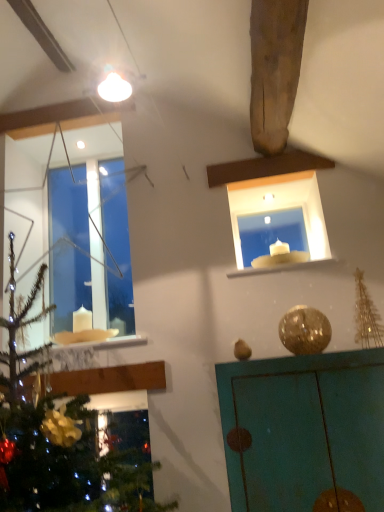
Question: Is teal painted cabinet at upper right inside white marble window sill at upper center?

Choices:
 (A) no
 (B) yes

Answer: (A)

Question: From the image's perspective, is white marble window sill at upper center located beneath teal painted cabinet at upper right?

Choices:
 (A) no
 (B) yes

Answer: (A)

Question: Could you tell me if white marble window sill at upper center is facing teal painted cabinet at upper right?

Choices:
 (A) no
 (B) yes

Answer: (A)

Question: From a real-world perspective, does white marble window sill at upper center sit lower than teal painted cabinet at upper right?

Choices:
 (A) yes
 (B) no

Answer: (B)

Question: Does white marble window sill at upper center have a greater width compared to teal painted cabinet at upper right?

Choices:
 (A) yes
 (B) no

Answer: (B)

Question: From a real-world perspective, is white glass candle at upper center physically located above or below white marble window sill at upper center?

Choices:
 (A) above
 (B) below

Answer: (A)

Question: Looking at their shapes, would you say white glass candle at upper center is wider or thinner than white marble window sill at upper center?

Choices:
 (A) thin
 (B) wide

Answer: (A)

Question: In terms of size, does white glass candle at upper center appear bigger or smaller than white marble window sill at upper center?

Choices:
 (A) small
 (B) big

Answer: (B)

Question: Is white glass candle at upper center inside or outside of white marble window sill at upper center?

Choices:
 (A) outside
 (B) inside

Answer: (A)

Question: Is transparent glass window at upper left wider or thinner than teal painted cabinet at upper right?

Choices:
 (A) wide
 (B) thin

Answer: (B)

Question: From a real-world perspective, is transparent glass window at upper left physically located above or below teal painted cabinet at upper right?

Choices:
 (A) below
 (B) above

Answer: (B)

Question: From the image's perspective, is transparent glass window at upper left located above or below teal painted cabinet at upper right?

Choices:
 (A) above
 (B) below

Answer: (A)

Question: Based on their positions, is transparent glass window at upper left located to the left or right of teal painted cabinet at upper right?

Choices:
 (A) right
 (B) left

Answer: (B)

Question: From a real-world perspective, is teal painted cabinet at upper right positioned above or below transparent glass window at upper left?

Choices:
 (A) below
 (B) above

Answer: (A)

Question: From the image's perspective, is teal painted cabinet at upper right above or below transparent glass window at upper left?

Choices:
 (A) below
 (B) above

Answer: (A)